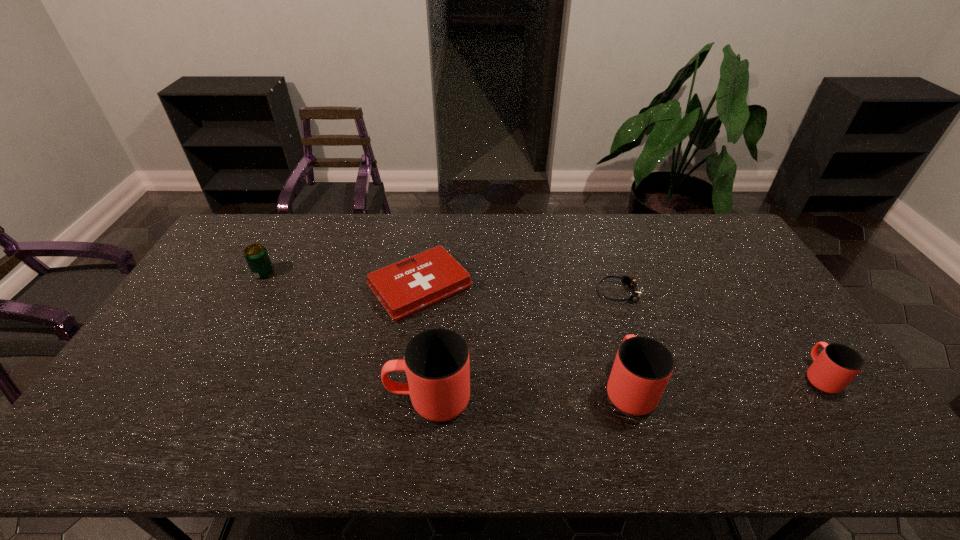
With all cups evenly spaced, where should an extra cup be placed on the left to continue the pattern? Please point out a vacant space. Please provide its 2D coordinates. Your answer should be formatted as a tuple, i.e. [(x, y)], where the tuple contains the x and y coordinates of a point satisfying the conditions above.

[(220, 411)]